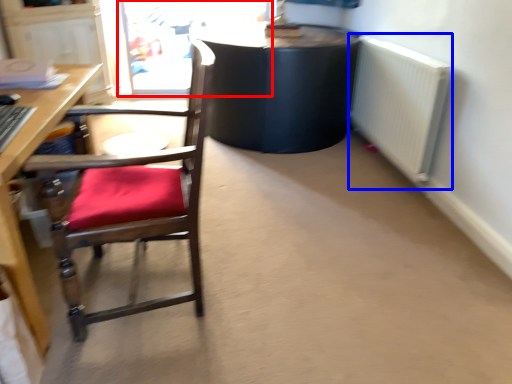
Question: Which object is further to the camera taking this photo, screen door (highlighted by a red box) or radiator (highlighted by a blue box)?

Choices:
 (A) screen door
 (B) radiator

Answer: (A)